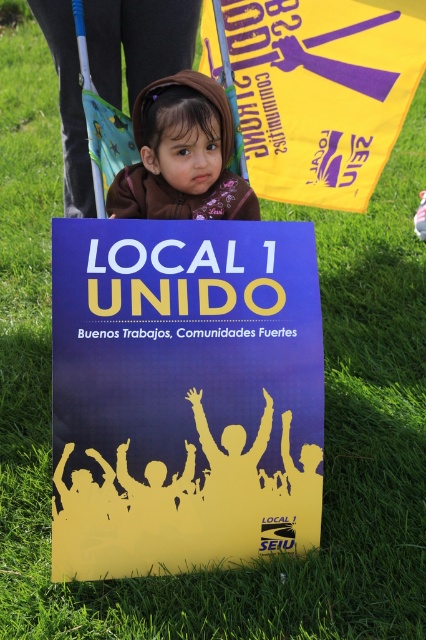
Question: Can you confirm if blue paper poster at center is positioned to the left of brown fabric at center?

Choices:
 (A) no
 (B) yes

Answer: (B)

Question: Which point is closer to the camera taking this photo?

Choices:
 (A) (167, 156)
 (B) (241, 60)

Answer: (A)

Question: Which of the following is the closest to the observer?

Choices:
 (A) yellow matte poster at center
 (B) blue paper poster at center

Answer: (B)

Question: Considering the relative positions of blue paper poster at center and yellow matte poster at center in the image provided, where is blue paper poster at center located with respect to yellow matte poster at center?

Choices:
 (A) left
 (B) right

Answer: (A)

Question: Which object is the closest to the yellow matte poster at center?

Choices:
 (A) brown fabric at center
 (B) blue paper poster at center

Answer: (A)

Question: Is yellow matte poster at center below brown fabric at center?

Choices:
 (A) no
 (B) yes

Answer: (A)